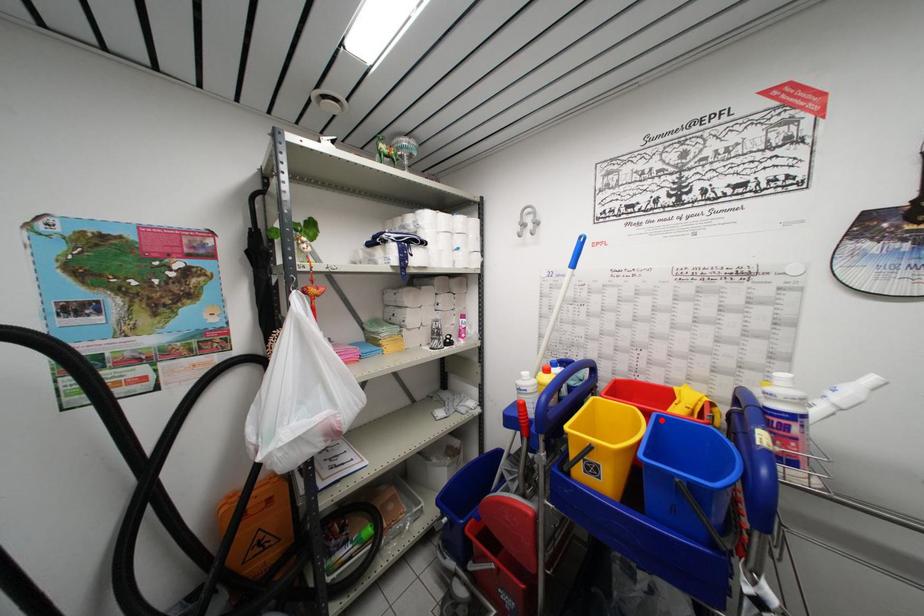
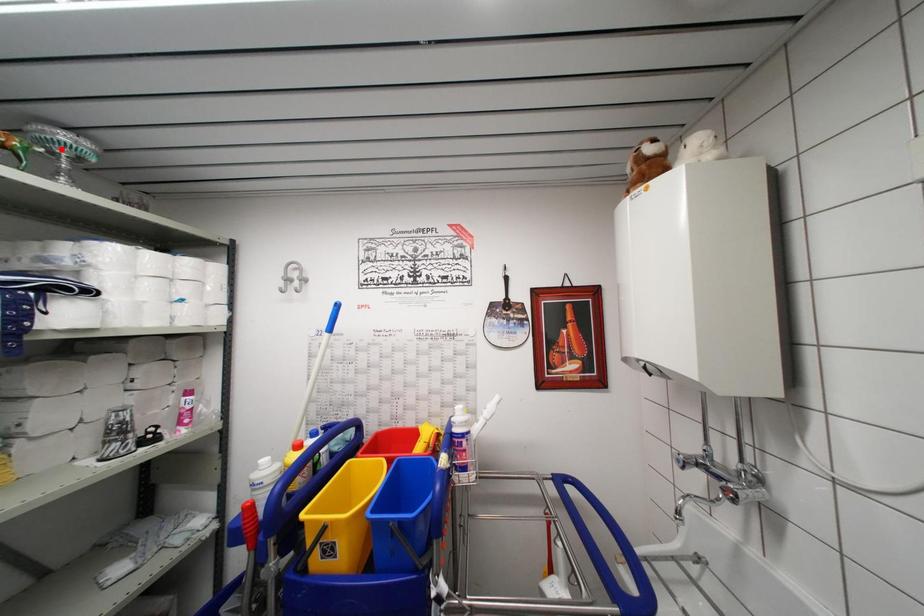
I am providing you with two images of the same scene from different viewpoints. A red point is marked on the first image and another point is marked on the second image. Do the highlighted points in image1 and image2 indicate the same real-world spot?

No